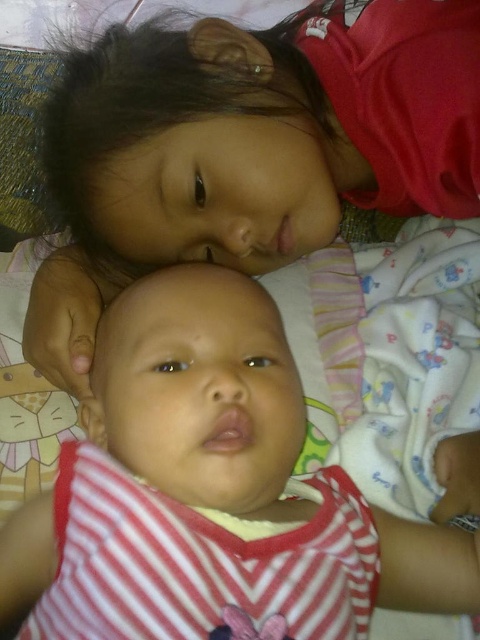
Based on the photo, can you confirm if matte red shirt at upper center is positioned to the left of striped fabric baby at center?

No, matte red shirt at upper center is not to the left of striped fabric baby at center.

I want to click on matte red shirt at upper center, so click(x=251, y=147).